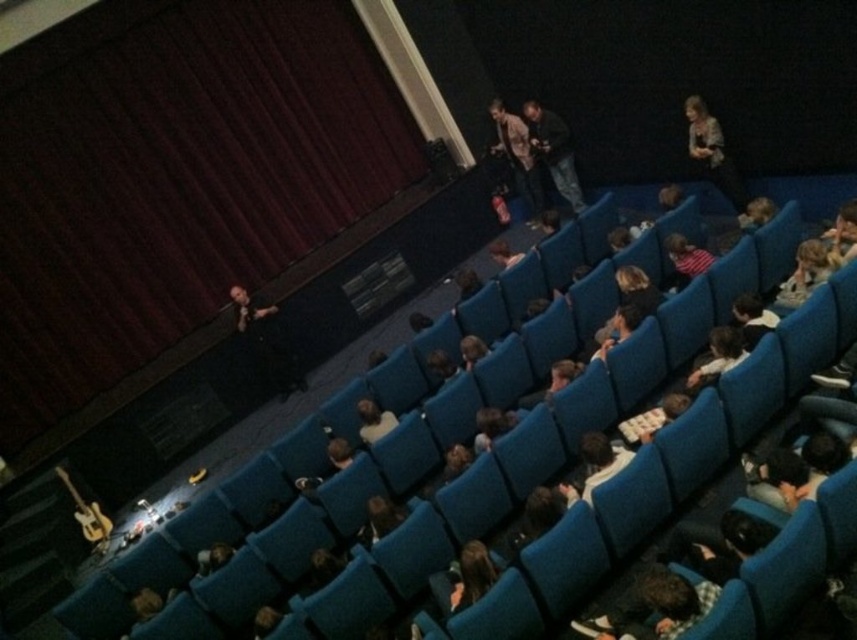
You are sitting in the movie theater and want to know which of the two points, point [304,234] or point [696,262], is closer to you. Can you determine this based on their positions?

Point [304,234] is further to the viewer than point [696,262], so the closer point to you is point [696,262].

Based on the photo, you are an event organizer checking the stage setup. You need to ensure that the dark blue jeans at center and the light brown leather jacket at upper center are visible to the audience. Based on their sizes, which one might require more space on the stage to be clearly seen?

The dark blue jeans at center has a larger width than the light brown leather jacket at upper center, so it might require more space on the stage to be clearly seen.

You are an event organizer who needs to decide whether to place a large banner on the stage. The banner is as big as the dark red velvet curtain at upper left. Will it fit in the space where the striped fabric shirt at right is currently located?

The dark red velvet curtain at upper left is bigger than the striped fabric shirt at right. Since the banner is as big as the curtain, it won generated by the system. 1. Please follow the rules and regenerate the question and answer. The user wants to know if the banner can fit in the space where the striped fabric shirt is located. The answer should be based on the size comparison provided in the Objects Description. 2. Ensure the question mentions both objects exactly as listed in the Objects section. 3.